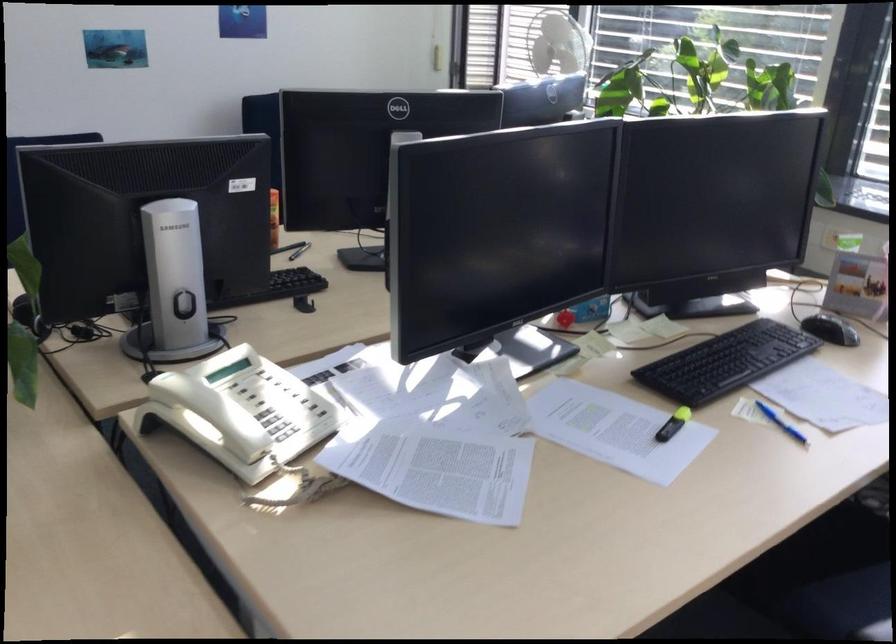
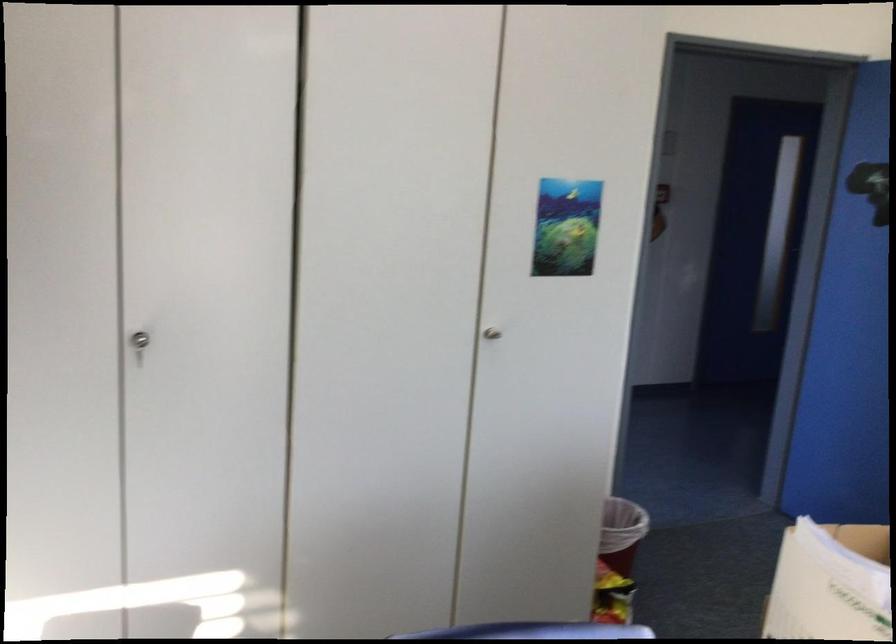
First-person continuous shooting, in which direction is the camera rotating?

The camera rotated toward left-down.